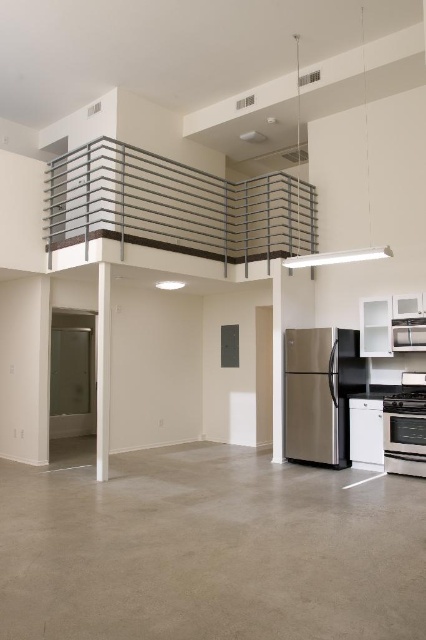
You are standing at the point labeled point [192,204] and want to reach the entrance door located at the opposite corner of the room. If the room is a perfect square with each side measuring 10 meters, can you walk directly to the door without crossing any obstacles?

Yes, you can walk directly to the door because the distance between point [192,204] and the entrance door is 8.19 meters, which is less than the diagonal of the room. Since the room is a perfect square with sides of 10 meters, the diagonal is approximately 14.14 meters. Therefore, the path is clear.

You are an interior designer assessing the layout of this modern living space. You need to install a decorative shelf that requires a minimum height of 1.8 meters. Given the metallic silver balustrade at upper center and the satin stainless steel oven at lower right, which object would be suitable for mounting the shelf?

The metallic silver balustrade at upper center has a greater height compared to the satin stainless steel oven at lower right, so it would be suitable for mounting the decorative shelf requiring a minimum height of 1.8 meters.